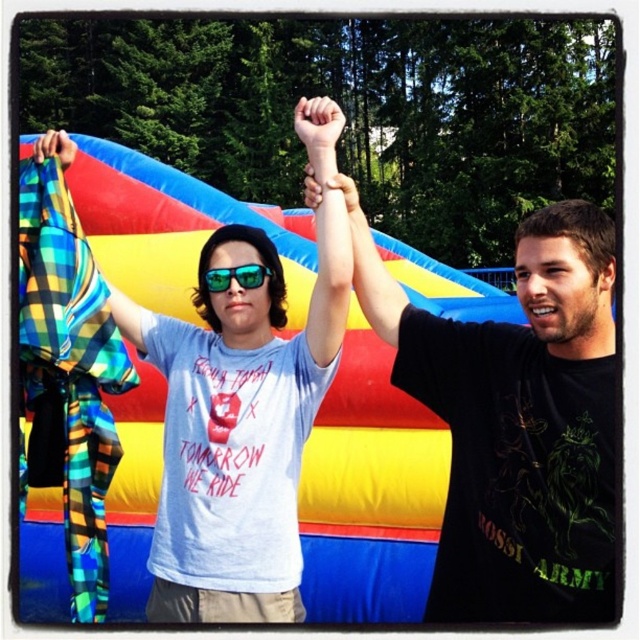
Question: Estimate the real-world distances between objects in this image. Which object is closer to the matte black arm at center?

Choices:
 (A) smooth skin hand at center
 (B) green reflective sunglasses at center

Answer: (B)

Question: Is light blue t-shirt at center further to the viewer compared to matte black arm at center?

Choices:
 (A) no
 (B) yes

Answer: (B)

Question: Does light blue t-shirt at center appear on the right side of smooth skin hand at center?

Choices:
 (A) yes
 (B) no

Answer: (A)

Question: Is smooth skin hand at center bigger than multicolored plaid scarf at upper left?

Choices:
 (A) yes
 (B) no

Answer: (A)

Question: Which of the following is the farthest from the observer?

Choices:
 (A) matte black arm at center
 (B) multicolored plaid scarf at upper left
 (C) black matte t-shirt at upper right

Answer: (A)

Question: Which point is farther from the camera taking this photo?

Choices:
 (A) (54, 140)
 (B) (296, 131)
 (C) (308, 205)

Answer: (B)